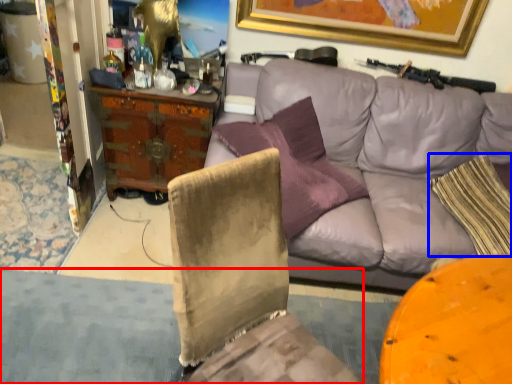
Question: Which of the following is the farthest to the observer, gray (highlighted by a red box) or pillow (highlighted by a blue box)?

Choices:
 (A) gray
 (B) pillow

Answer: (B)